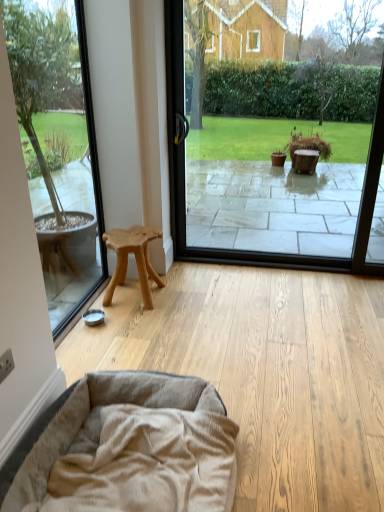
Question: From a real-world perspective, is natural wood stool at left above or below transparent glass window at center, which is counted as the first window screen, starting from the right?

Choices:
 (A) below
 (B) above

Answer: (A)

Question: In terms of size, does natural wood stool at left appear bigger or smaller than transparent glass window at center, which is counted as the first window screen, starting from the right?

Choices:
 (A) big
 (B) small

Answer: (B)

Question: Which of these objects is positioned closest to the transparent glass window at center, which is counted as the first window screen, starting from the right?

Choices:
 (A) transparent glass window at left, positioned as the 1th window screen in left-to-right order
 (B) natural wood stool at left
 (C) beige plush dog bed at lower left

Answer: (A)

Question: Estimate the real-world distances between objects in this image. Which object is farther from the transparent glass window at left, which is the 2th window screen in right-to-left order?

Choices:
 (A) transparent glass window at center, which is the second window screen in left-to-right order
 (B) natural wood stool at left
 (C) beige plush dog bed at lower left

Answer: (A)